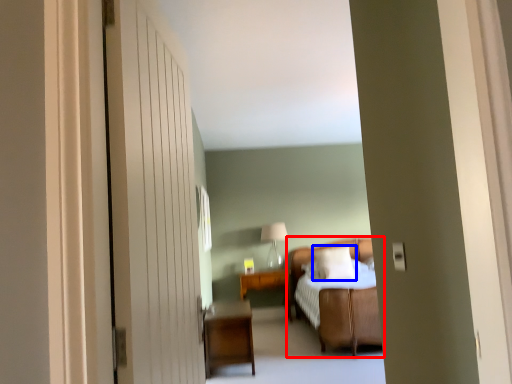
Question: Which object is further to the camera taking this photo, bed (highlighted by a red box) or pillow (highlighted by a blue box)?

Choices:
 (A) bed
 (B) pillow

Answer: (B)